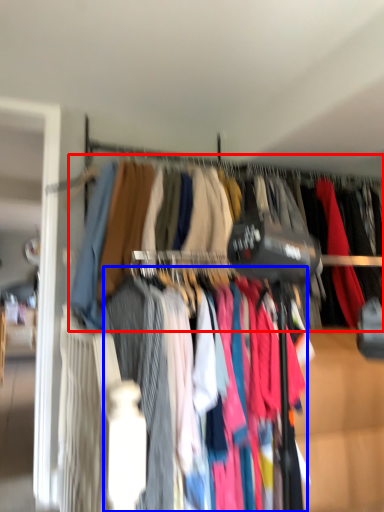
Question: Which of the following is the closest to the observer, closet (highlighted by a red box) or clothing (highlighted by a blue box)?

Choices:
 (A) closet
 (B) clothing

Answer: (B)